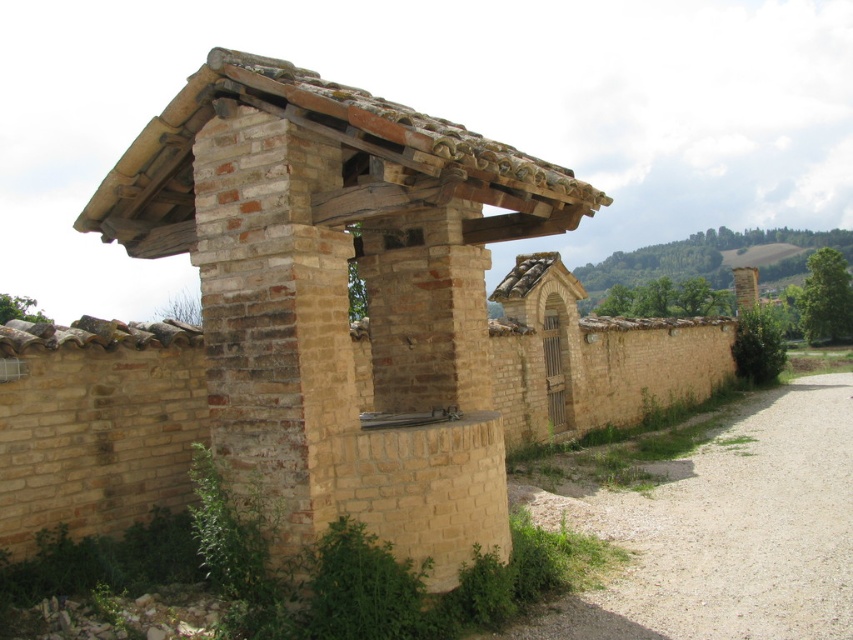
You are standing at the starting point of the gravel path and see two points marked on the image. The first point is at coordinate point (346, 240) and the second is at point (709, 588). Which point is closer to you?

→ Point (346, 240) is in front of point (709, 588), so it is closer to you.